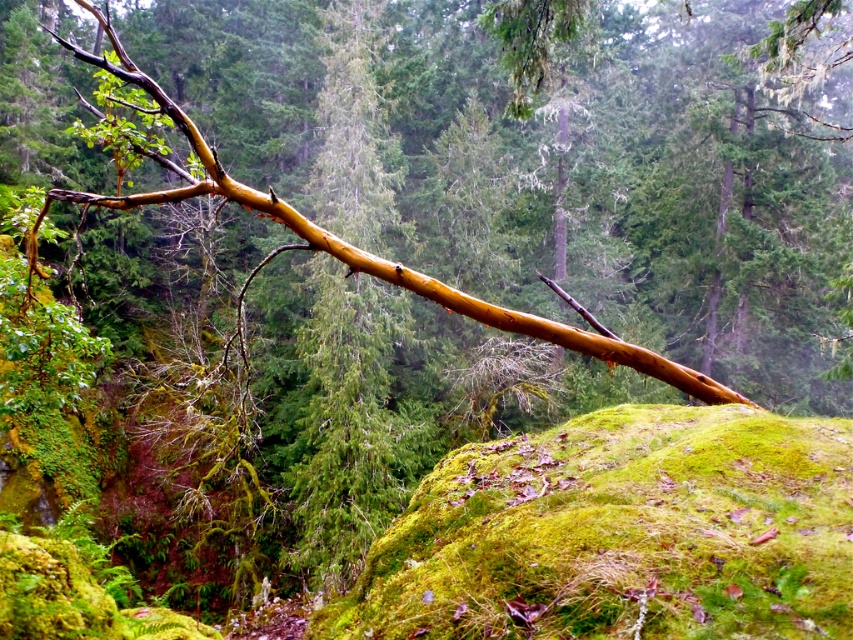
You are a hiker who wants to place a 30 feet long tent between the green mossy rock at center and the glossy brown branch at upper center. Is there enough space for the tent?

The green mossy rock at center and glossy brown branch at upper center are 35.86 feet apart, so yes, the tent can be placed between them as the distance is sufficient to accommodate its 30 feet length.

You are standing at the point labeled point (621, 532) in the forest scene. What object are you standing on?

You are standing on the green mossy rock at center.

You are a hiker trying to navigate through the forest. You see a green mossy rock at center and a glossy brown branch at upper center. Which object is taller?

The glossy brown branch at upper center is taller than the green mossy rock at center.